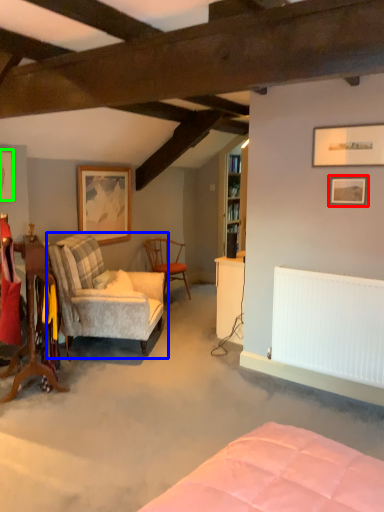
Question: Considering the real-world distances, which object is farthest from picture frame (highlighted by a red box)? chair (highlighted by a blue box) or picture frame (highlighted by a green box)?

Choices:
 (A) chair
 (B) picture frame

Answer: (B)